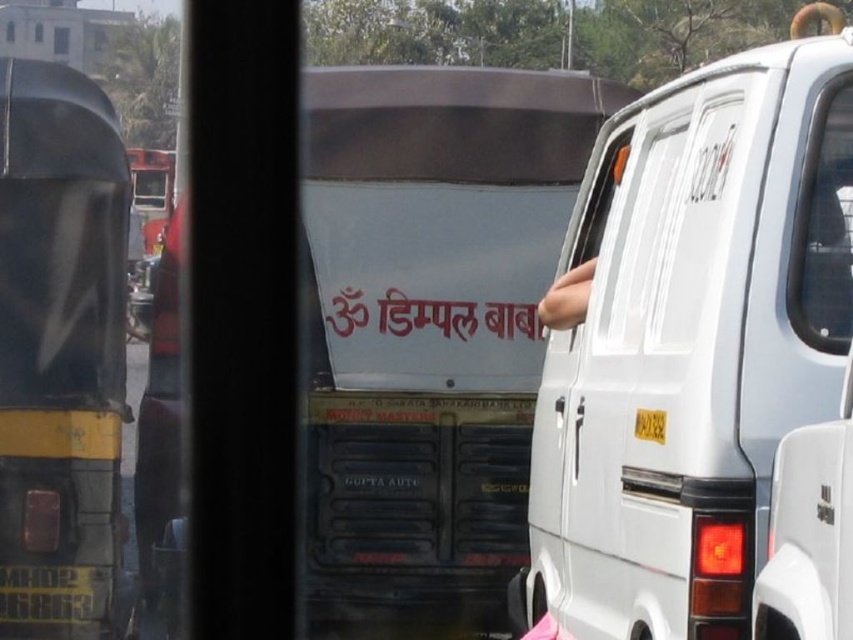
Between white matte van at center and yellow metallic license plate at lower left, which one is positioned higher?

Positioned higher is white matte van at center.

Can you confirm if white matte van at center is positioned below yellow metallic license plate at lower left?

Incorrect, white matte van at center is not positioned below yellow metallic license plate at lower left.

Who is more distant from viewer, (840,344) or (49,586)?

Point (49,586)

The width and height of the screenshot is (853, 640). In order to click on white matte van at center in this screenshot , I will do `click(689, 340)`.

Does white matte van at center have a greater height compared to yellow matte truck at left?

Incorrect, white matte van at center's height is not larger of yellow matte truck at left's.

Describe the element at coordinates (689, 340) in the screenshot. I see `white matte van at center` at that location.

Is point (699, 68) positioned behind point (125, 230)?

Yes, it is behind point (125, 230).

Find the location of a particular element. white matte van at center is located at coordinates (689, 340).

Does yellow matte truck at left appear over yellow metallic license plate at lower left?

Indeed, yellow matte truck at left is positioned over yellow metallic license plate at lower left.

Who is positioned more to the right, yellow matte truck at left or yellow metallic license plate at lower left?

From the viewer's perspective, yellow matte truck at left appears more on the right side.

Describe the element at coordinates (61, 352) in the screenshot. I see `yellow matte truck at left` at that location.

Find the location of a particular element. yellow matte truck at left is located at coordinates (61, 352).